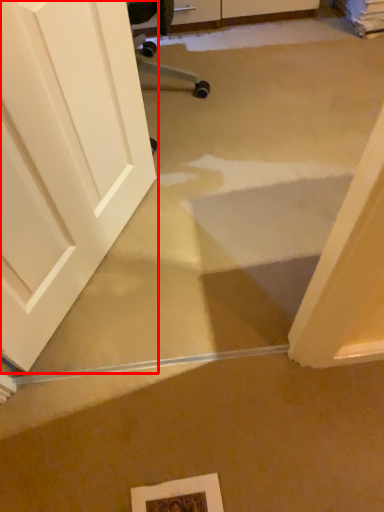
Question: Observing the image, what is the correct spatial positioning of door (annotated by the red box) in reference to picture frame?

Choices:
 (A) left
 (B) right

Answer: (A)